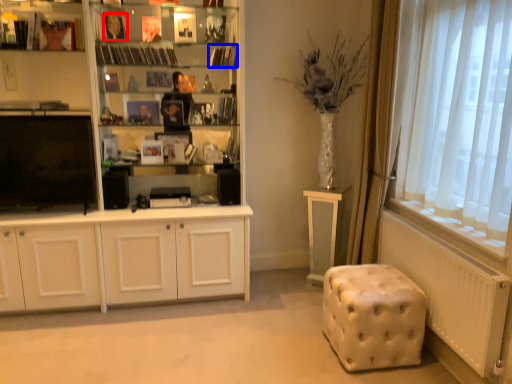
Question: Which point is closer to the camera, book (highlighted by a red box) or book (highlighted by a blue box)?

Choices:
 (A) book
 (B) book

Answer: (A)